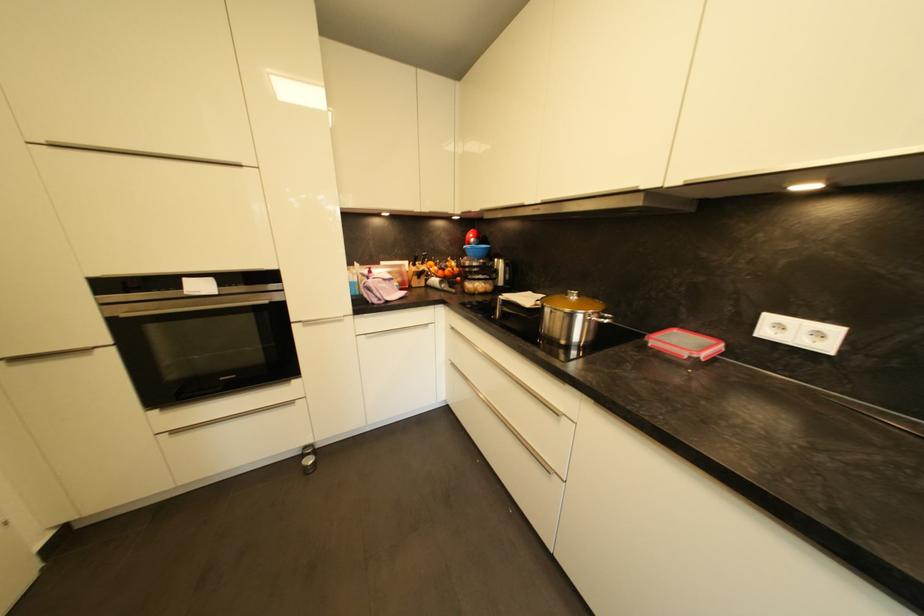
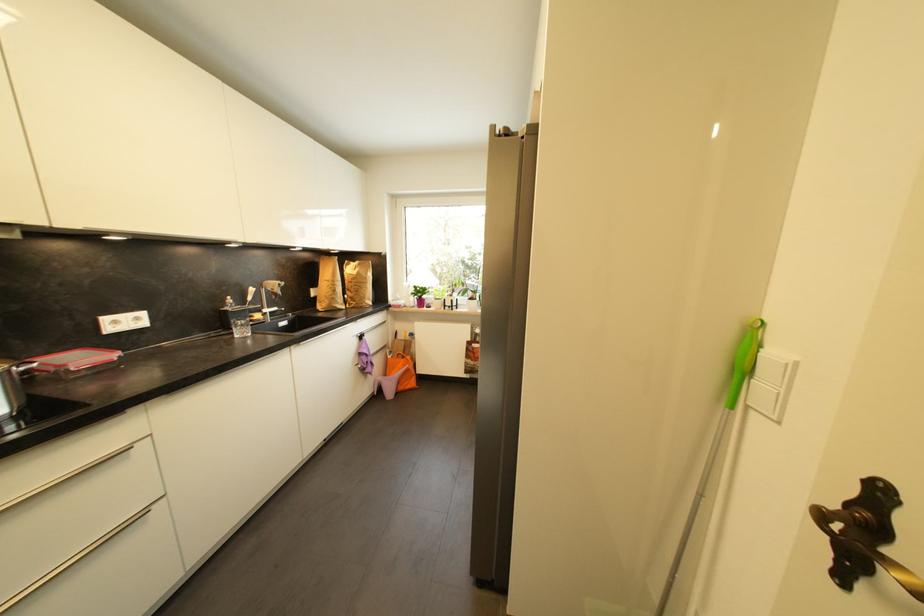
Find the pixel in the second image that matches (700,333) in the first image.

(54, 355)